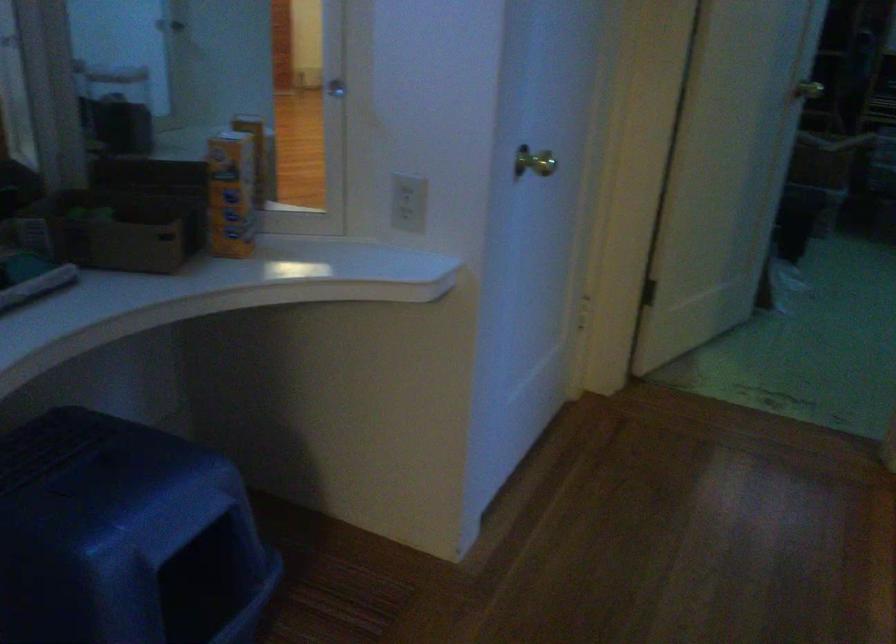
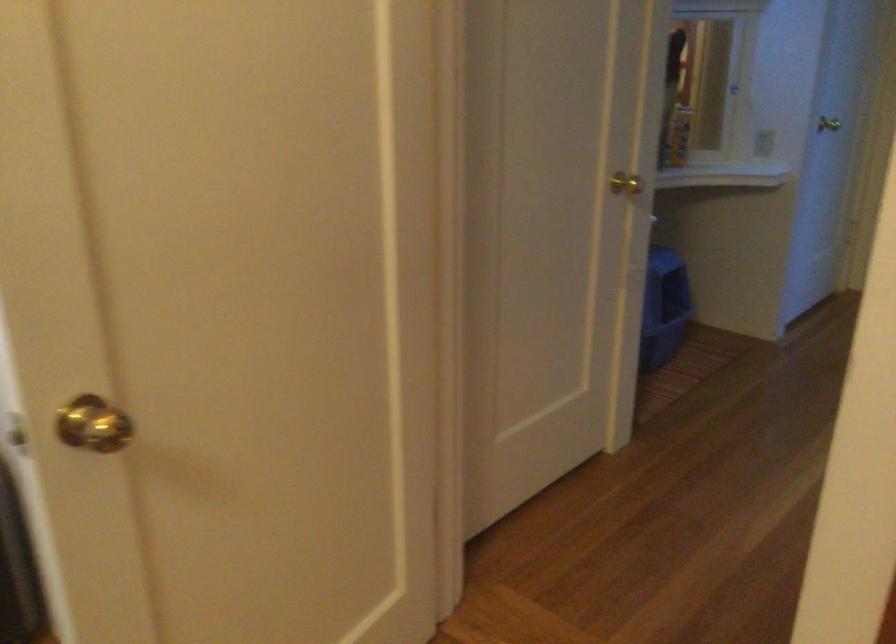
Question: I am providing you with two images of the same scene from different viewpoints. Which of the following objects are not visible in image2?

Choices:
 (A) blue litter box
 (B) sword hilt
 (C) light switch
 (D) brass doorknob

Answer: (A)